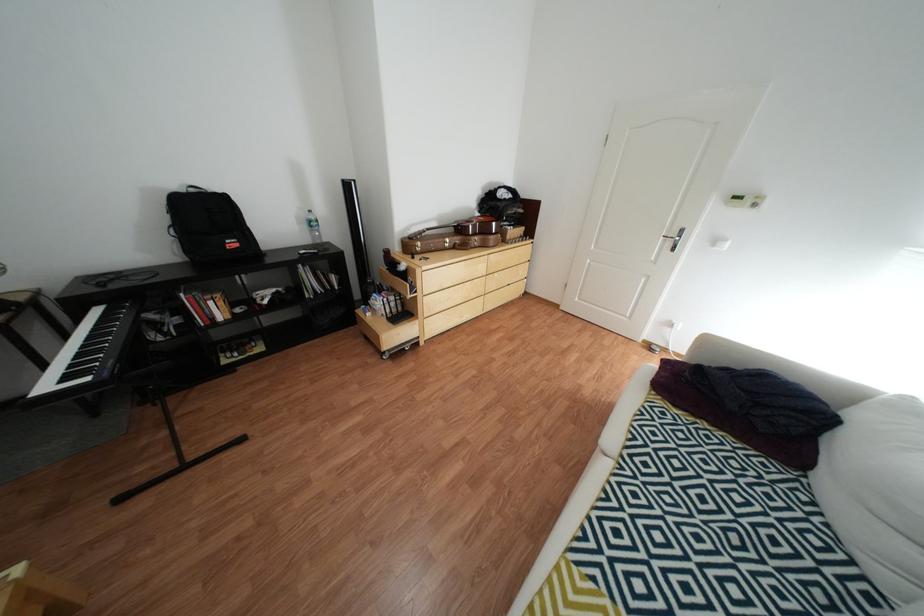
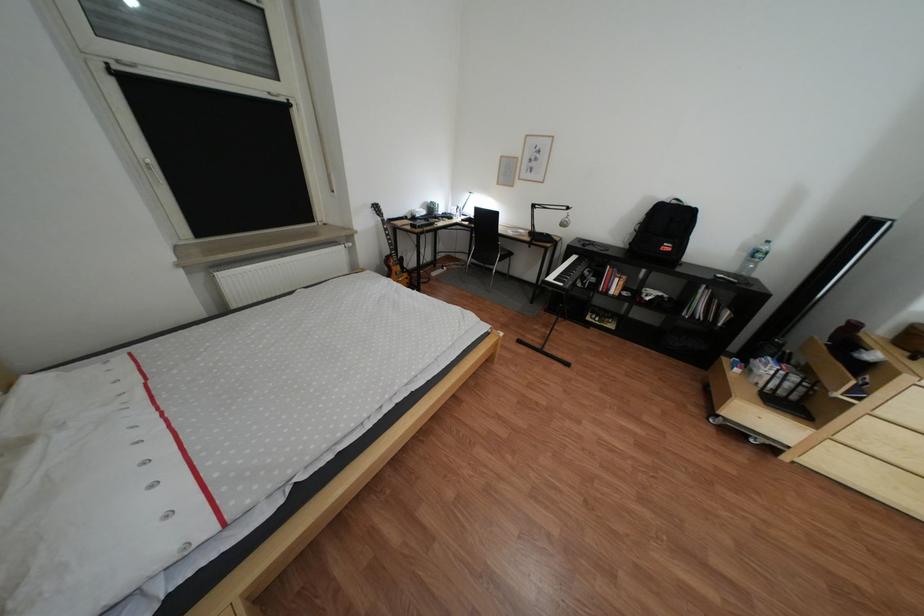
Find the pixel in the second image that matches (248,245) in the first image.

(683, 248)